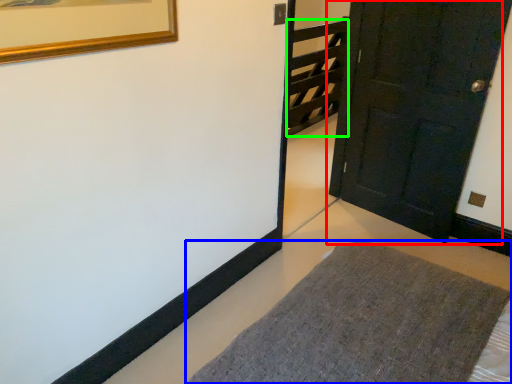
Question: Based on their relative distances, which object is nearer to door (highlighted by a red box)? Choose from furniture (highlighted by a blue box) and stairwell (highlighted by a green box).

Choices:
 (A) furniture
 (B) stairwell

Answer: (A)